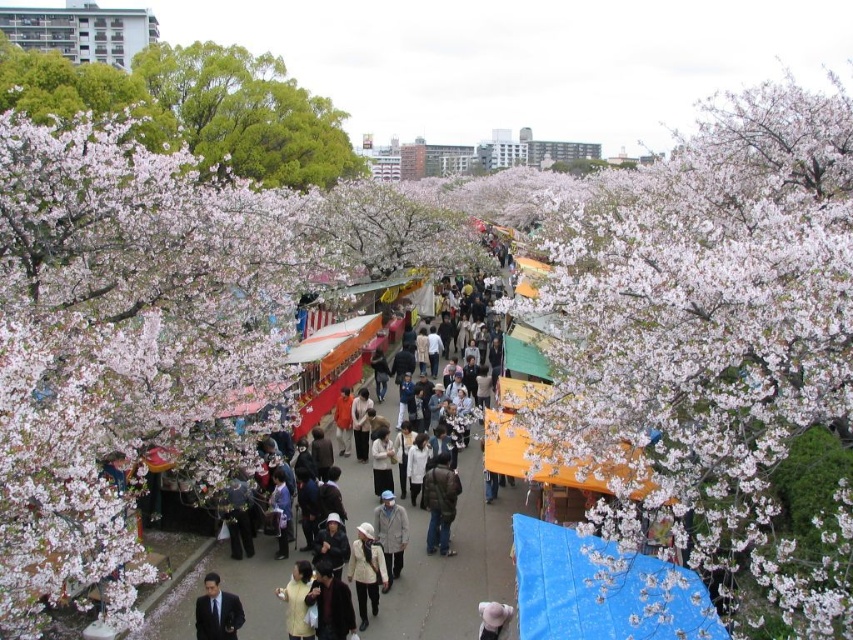
You are standing on the pathway at the cherry blossom festival. You see the fluffy white blossoms at left and the light yellow fabric at center. Which object is higher in the scene?

The fluffy white blossoms at left are higher than the light yellow fabric at center.

You are standing at the entrance of the cherry blossom festival pathway and see two points marked in the image. Which point, point (x=701, y=502) or point (x=219, y=636), is closer to you?

Point (x=701, y=502) is closer to the viewer than point (x=219, y=636).

You are walking along the pathway and see the fluffy white blossoms at left and the light yellow fabric at center. Which object is positioned more to the east if the pathway runs from west to east?

The fluffy white blossoms at left are to the left of the light yellow fabric at center. Since the pathway runs west to east, the left side would be the western end. Therefore, the fluffy white blossoms at left are positioned more to the west, meaning the light yellow fabric at center is more to the east.